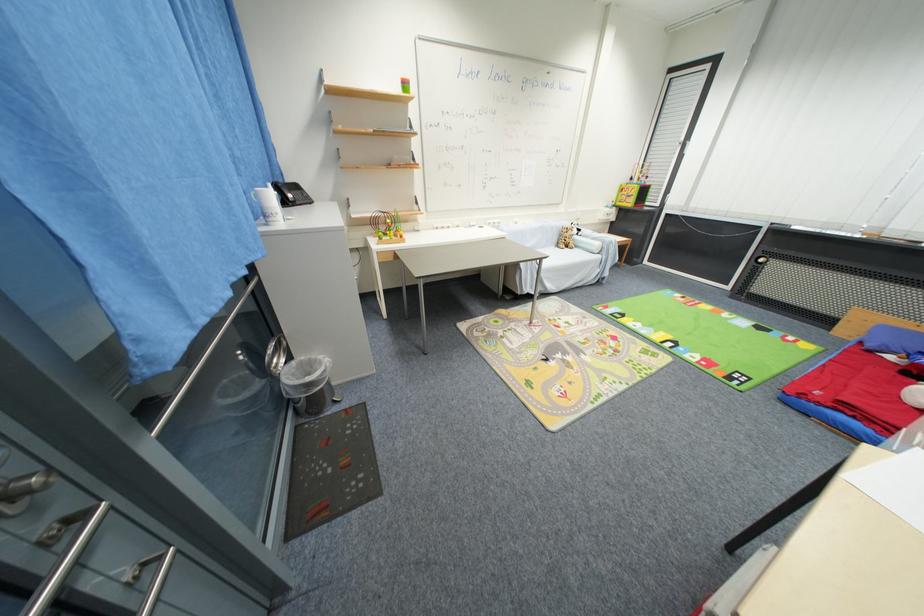
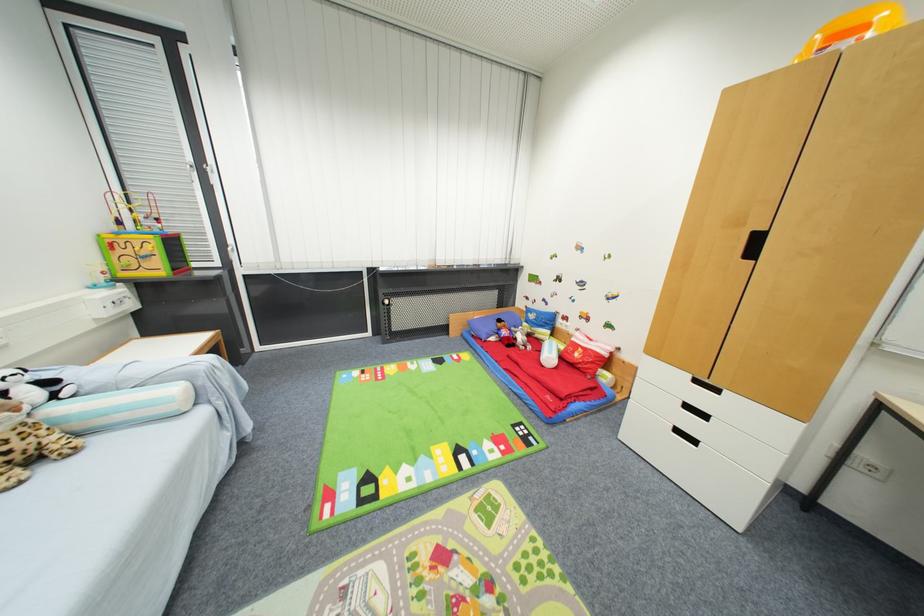
Where in the second image is the point corresponding to the point at 886,331 from the first image?

(475, 325)